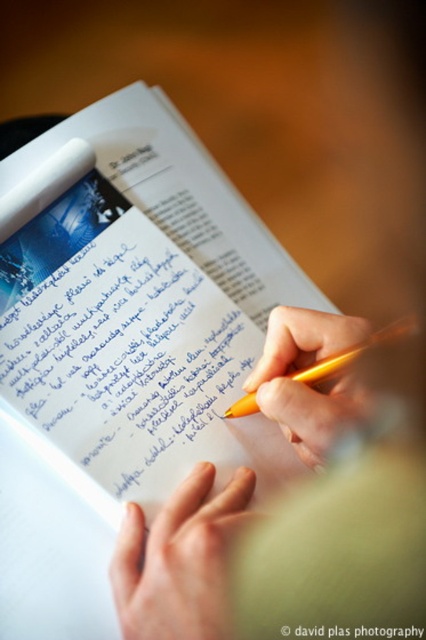
Question: Which object appears closest to the camera in this image?

Choices:
 (A) smooth skin hand at center
 (B) yellow plastic pen at center

Answer: (A)

Question: Can you confirm if smooth skin hand at center is positioned below yellow plastic pen at center?

Choices:
 (A) yes
 (B) no

Answer: (A)

Question: Is smooth skin hand at center below yellow plastic pen at center?

Choices:
 (A) no
 (B) yes

Answer: (B)

Question: Which object appears farthest from the camera in this image?

Choices:
 (A) smooth skin hand at center
 (B) yellow plastic pen at center

Answer: (B)

Question: Which point is farther from the camera taking this photo?

Choices:
 (A) (123, 566)
 (B) (342, 410)

Answer: (B)

Question: Can you confirm if smooth skin hand at center is positioned below yellow plastic pen at center?

Choices:
 (A) no
 (B) yes

Answer: (B)